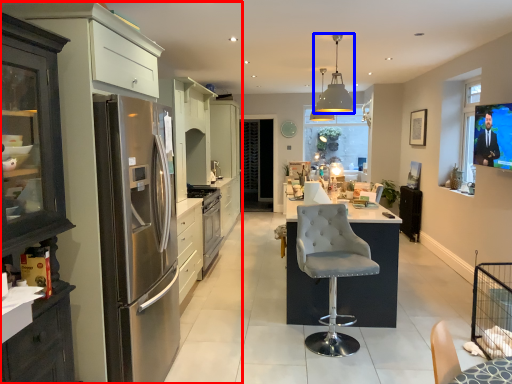
Question: Which of the following is the farthest to the observer, entertainment center (highlighted by a red box) or light fixture (highlighted by a blue box)?

Choices:
 (A) entertainment center
 (B) light fixture

Answer: (B)